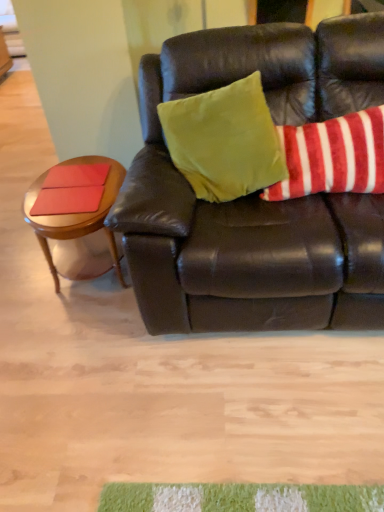
Question: Considering the relative sizes of velvety green pillow at upper center, arranged as the second pillow when viewed from the right, and red/white striped pillow at upper right, the second pillow when ordered from left to right, in the image provided, is velvety green pillow at upper center, arranged as the second pillow when viewed from the right, bigger than red/white striped pillow at upper right, the second pillow when ordered from left to right,?

Choices:
 (A) yes
 (B) no

Answer: (A)

Question: Is velvety green pillow at upper center, arranged as the second pillow when viewed from the right, oriented towards red/white striped pillow at upper right, the 1th pillow when ordered from right to left?

Choices:
 (A) yes
 (B) no

Answer: (B)

Question: From a real-world perspective, is velvety green pillow at upper center, which is the first pillow in left-to-right order, positioned under red/white striped pillow at upper right, the second pillow when ordered from left to right, based on gravity?

Choices:
 (A) no
 (B) yes

Answer: (A)

Question: Is velvety green pillow at upper center, arranged as the second pillow when viewed from the right, further to the viewer compared to red/white striped pillow at upper right, the 1th pillow when ordered from right to left?

Choices:
 (A) yes
 (B) no

Answer: (B)

Question: Does velvety green pillow at upper center, which is the first pillow in left-to-right order, appear on the right side of red/white striped pillow at upper right, the second pillow when ordered from left to right?

Choices:
 (A) no
 (B) yes

Answer: (A)

Question: Can you confirm if velvety green pillow at upper center, which is the first pillow in left-to-right order, is shorter than red/white striped pillow at upper right, the second pillow when ordered from left to right?

Choices:
 (A) yes
 (B) no

Answer: (B)

Question: Is matte red pad at left, which ranks as the second pad in front-to-back order, bigger than velvety green pillow at upper center, arranged as the second pillow when viewed from the right?

Choices:
 (A) yes
 (B) no

Answer: (B)

Question: Is matte red pad at left, the second pad from the bottom, to the right of velvety green pillow at upper center, arranged as the second pillow when viewed from the right, from the viewer's perspective?

Choices:
 (A) no
 (B) yes

Answer: (A)

Question: Can you see matte red pad at left, which ranks as the second pad in front-to-back order, touching velvety green pillow at upper center, which is the first pillow in left-to-right order?

Choices:
 (A) no
 (B) yes

Answer: (A)

Question: Considering the relative sizes of matte red pad at left, the first pad in the back-to-front sequence, and velvety green pillow at upper center, which is the first pillow in left-to-right order, in the image provided, is matte red pad at left, the first pad in the back-to-front sequence, taller than velvety green pillow at upper center, which is the first pillow in left-to-right order,?

Choices:
 (A) no
 (B) yes

Answer: (A)

Question: From a real-world perspective, is matte red pad at left, the first pad in the back-to-front sequence, under velvety green pillow at upper center, arranged as the second pillow when viewed from the right?

Choices:
 (A) yes
 (B) no

Answer: (A)

Question: Are matte red pad at left, the first pad positioned from the top, and velvety green pillow at upper center, which is the first pillow in left-to-right order, located far from each other?

Choices:
 (A) no
 (B) yes

Answer: (A)

Question: Is woodenwoodentable at left not near matte brown leather couch at center?

Choices:
 (A) yes
 (B) no

Answer: (B)